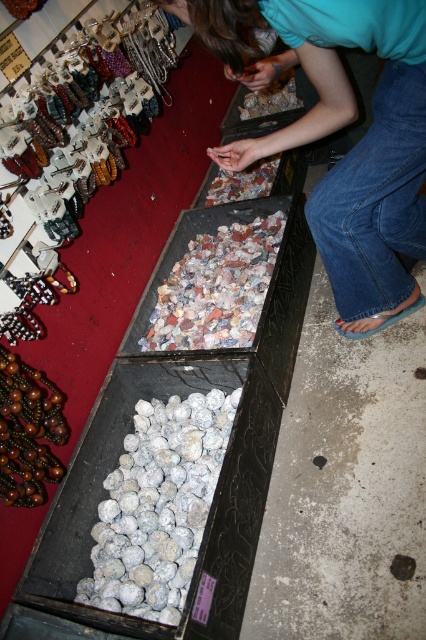
Question: Estimate the real-world distances between objects in this image. Which object is closer to the white matte pebbles at center?

Choices:
 (A) brown wooden beads at lower left
 (B) denim jeans at lower right
 (C) wooden beads at left

Answer: (A)

Question: Is denim jeans at lower right below white matte pebbles at center?

Choices:
 (A) yes
 (B) no

Answer: (B)

Question: Does white matte pebbles at center have a greater width compared to brown wooden beads at lower left?

Choices:
 (A) no
 (B) yes

Answer: (B)

Question: Which point appears farthest from the camera in this image?

Choices:
 (A) click(149, 88)
 (B) click(141, 616)

Answer: (A)

Question: Estimate the real-world distances between objects in this image. Which object is closer to the white matte pebbles at center?

Choices:
 (A) denim jeans at lower right
 (B) brown wooden beads at lower left
 (C) wooden beads at left

Answer: (B)

Question: Is denim jeans at lower right wider than wooden beads at left?

Choices:
 (A) yes
 (B) no

Answer: (A)